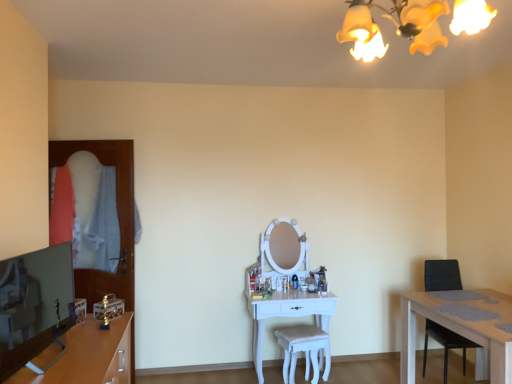
Question: In terms of height, does white fabric stool at center look taller or shorter compared to white glossy vanity at center?

Choices:
 (A) tall
 (B) short

Answer: (B)

Question: Is white fabric stool at center inside or outside of white glossy vanity at center?

Choices:
 (A) inside
 (B) outside

Answer: (A)

Question: Estimate the real-world distances between objects in this image. Which object is farther from the matte wooden tv stand at lower left?

Choices:
 (A) white glossy vanity at center
 (B) yellow fabric lampshade at upper center
 (C) black leather chair at right
 (D) white fabric stool at center

Answer: (C)

Question: Which object is positioned closest to the black leather chair at right?

Choices:
 (A) matte wooden tv stand at lower left
 (B) white fabric stool at center
 (C) yellow fabric lampshade at upper center
 (D) white glossy vanity at center

Answer: (B)